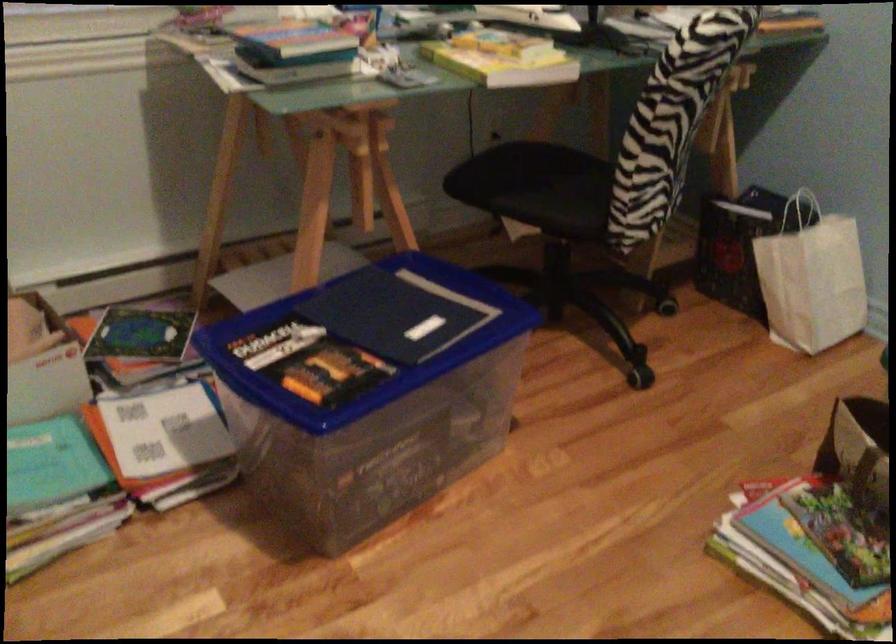
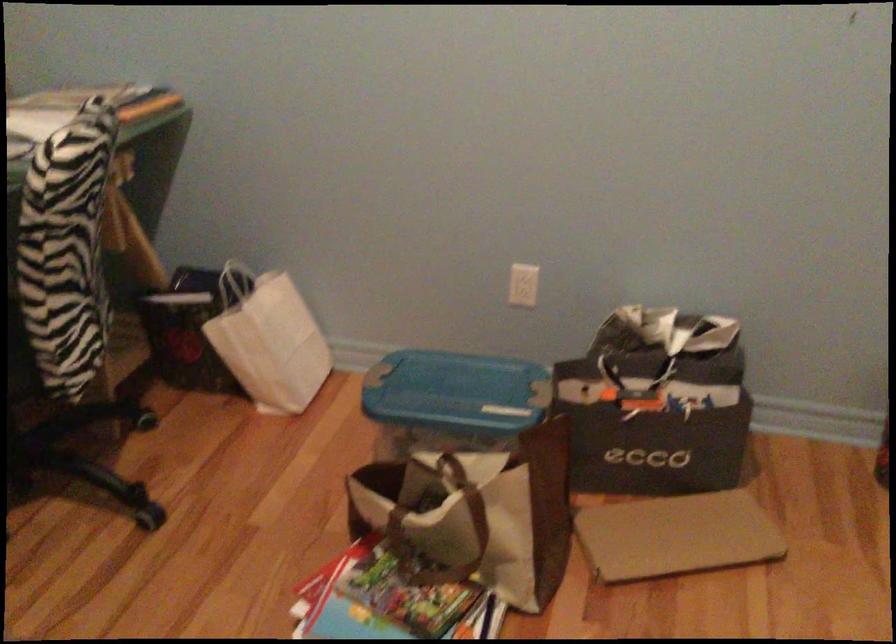
The point at (798, 205) is marked in the first image. Where is the corresponding point in the second image?

(236, 281)